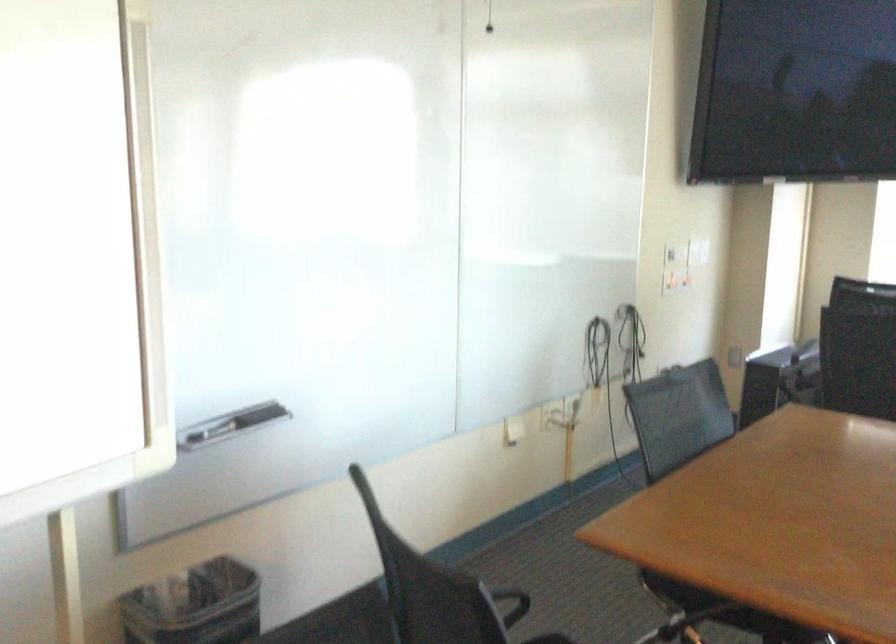
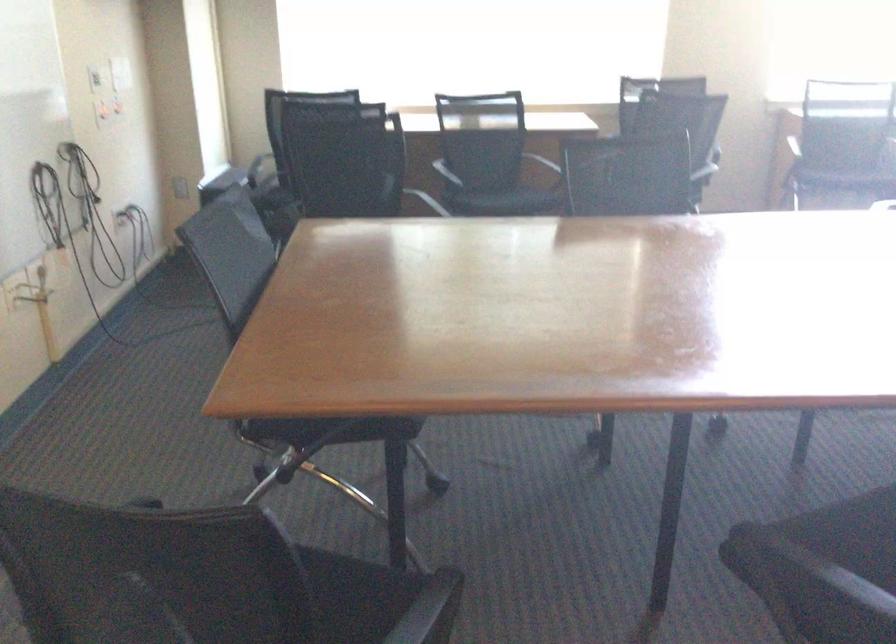
Question: The camera is either moving clockwise (left) or counter-clockwise (right) around the object. The first image is from the beginning of the video and the second image is from the end. Is the camera moving left or right when shooting the video?

Choices:
 (A) Left
 (B) Right

Answer: (A)